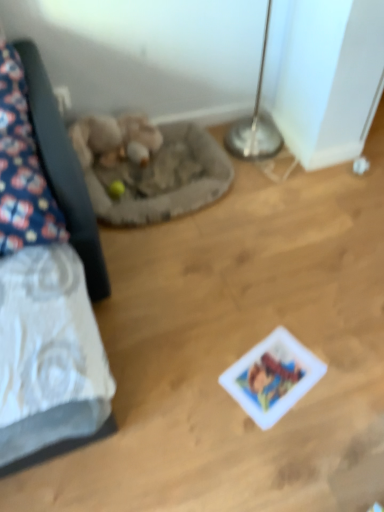
Locate an element on the screen. This screenshot has width=384, height=512. vacant area that is situated to the right of gray fabric cat bed at center-left is located at coordinates (288, 219).